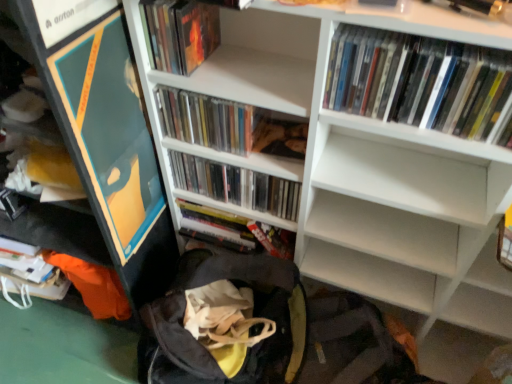
Question: Does clear plastic cds at center, the third book from the back, appear on the right side of white glossy dvds at upper right, the first book from the front?

Choices:
 (A) yes
 (B) no

Answer: (B)

Question: Is there a large distance between clear plastic cds at center, the third book from the back, and white glossy dvds at upper right, placed as the fifth book when sorted from back to front?

Choices:
 (A) no
 (B) yes

Answer: (A)

Question: Can you confirm if clear plastic cds at center, which is the 3th book from front to back, is bigger than white glossy dvds at upper right, the first book from the front?

Choices:
 (A) yes
 (B) no

Answer: (B)

Question: Is clear plastic cds at center, the third book from the back, positioned beyond the bounds of white glossy dvds at upper right, the first book from the front?

Choices:
 (A) yes
 (B) no

Answer: (A)

Question: From the image's perspective, is clear plastic cds at center, which is the 3th book from front to back, on white glossy dvds at upper right, placed as the fifth book when sorted from back to front?

Choices:
 (A) no
 (B) yes

Answer: (A)

Question: Considering the positions of silver metallic book at center, which is the 5th book in front-to-back order, and clear plastic cds at center, the third book from the back, in the image, is silver metallic book at center, which is the 5th book in front-to-back order, wider or thinner than clear plastic cds at center, the third book from the back,?

Choices:
 (A) thin
 (B) wide

Answer: (B)

Question: Is silver metallic book at center, which is the first book in back-to-front order, to the left or to the right of clear plastic cds at center, the third book from the back, in the image?

Choices:
 (A) left
 (B) right

Answer: (B)

Question: From the image's perspective, relative to clear plastic cds at center, which is the 3th book from front to back, is silver metallic book at center, which is the first book in back-to-front order, above or below?

Choices:
 (A) above
 (B) below

Answer: (B)

Question: In the image, is silver metallic book at center, which is the first book in back-to-front order, positioned in front of or behind clear plastic cds at center, the third book from the back?

Choices:
 (A) front
 (B) behind

Answer: (B)

Question: From a real-world perspective, is white matte bookcase at upper center above or below matte plastic book at upper left, which ranks as the 2th book in front-to-back order?

Choices:
 (A) above
 (B) below

Answer: (B)

Question: In the image, is white matte bookcase at upper center positioned in front of or behind matte plastic book at upper left, which ranks as the 2th book in front-to-back order?

Choices:
 (A) behind
 (B) front

Answer: (B)

Question: Considering the positions of white matte bookcase at upper center and matte plastic book at upper left, marked as the fourth book in a back-to-front arrangement, in the image, is white matte bookcase at upper center taller or shorter than matte plastic book at upper left, marked as the fourth book in a back-to-front arrangement,?

Choices:
 (A) tall
 (B) short

Answer: (A)

Question: Based on their sizes in the image, would you say white matte bookcase at upper center is bigger or smaller than matte plastic book at upper left, marked as the fourth book in a back-to-front arrangement?

Choices:
 (A) small
 (B) big

Answer: (B)

Question: Which is correct: matte plastic books at center, which is counted as the fourth book, starting from the front, is inside matte plastic book at upper left, which ranks as the 2th book in front-to-back order, or outside of it?

Choices:
 (A) outside
 (B) inside

Answer: (A)

Question: In terms of size, does matte plastic books at center, which is counted as the fourth book, starting from the front, appear bigger or smaller than matte plastic book at upper left, which ranks as the 2th book in front-to-back order?

Choices:
 (A) big
 (B) small

Answer: (A)